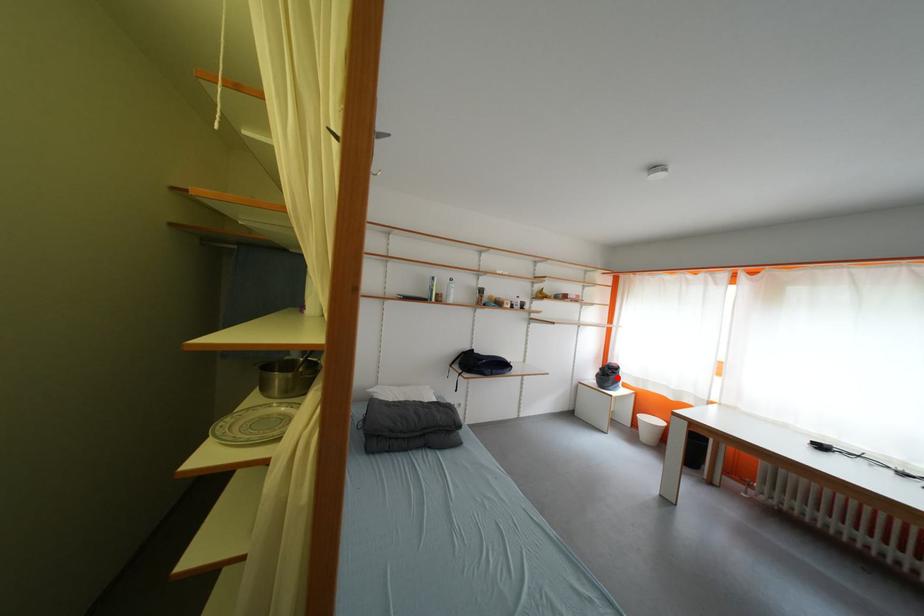
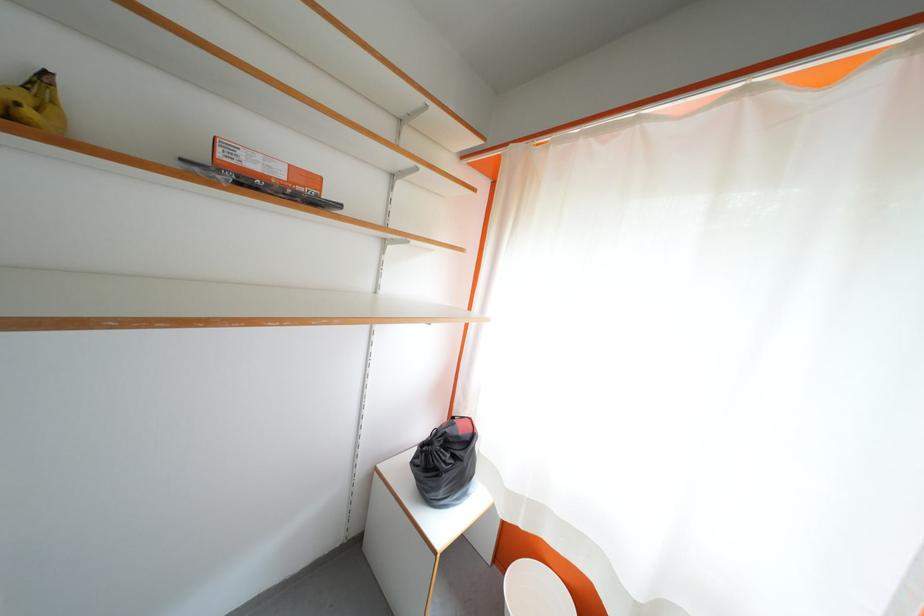
Question: I am providing you with two images of the same scene from different viewpoints. Given a red point in image1, look at the same physical point in image2. Is it:

Choices:
 (A) Closer to the viewpoint
 (B) Farther from the viewpoint

Answer: (B)